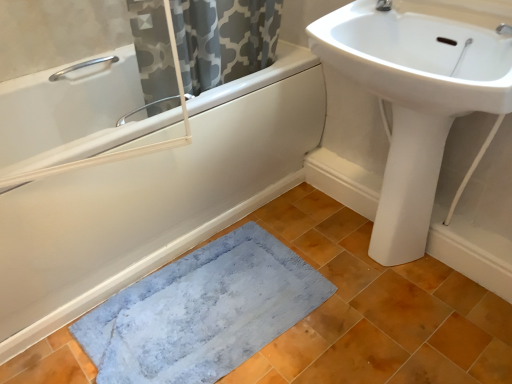
Find the location of a particular element. white matte bathtub at lower left is located at coordinates (154, 199).

The image size is (512, 384). Describe the element at coordinates (408, 186) in the screenshot. I see `white glossy bidet at lower right` at that location.

At what (x,y) coordinates should I click in order to perform the action: click on white glossy bidet at lower right. Please return your answer as a coordinate pair (x, y). The image size is (512, 384). Looking at the image, I should click on (408, 186).

Find the location of a particular element. This screenshot has width=512, height=384. white matte bathtub at lower left is located at coordinates (154, 199).

Is white glossy sink at upper right facing away from blue soft rug at lower left?

No, white glossy sink at upper right is not facing away from blue soft rug at lower left.

Which object is positioned more to the left, white glossy sink at upper right or blue soft rug at lower left?

Positioned to the left is blue soft rug at lower left.

Is point (379, 227) less distant than point (187, 255)?

Yes, point (379, 227) is closer to viewer.

Can you confirm if white glossy sink at upper right is bigger than blue soft rug at lower left?

Indeed, white glossy sink at upper right has a larger size compared to blue soft rug at lower left.

Consider the image. Who is smaller, blue soft rug at lower left or white glossy bidet at lower right?

blue soft rug at lower left is smaller.

Is the position of blue soft rug at lower left less distant than that of white glossy bidet at lower right?

Yes, blue soft rug at lower left is closer to the viewer.

Is blue soft rug at lower left taller or shorter than white glossy bidet at lower right?

Clearly, blue soft rug at lower left is shorter compared to white glossy bidet at lower right.

At what (x,y) coordinates should I click in order to perform the action: click on bath mat on the left side of white glossy bidet at lower right. Please return your answer as a coordinate pair (x, y). The height and width of the screenshot is (384, 512). Looking at the image, I should click on (202, 311).

In the scene shown: Is silver metallic grab bar at upper left looking in the opposite direction of white glossy sink at upper right?

No, silver metallic grab bar at upper left's orientation is not away from white glossy sink at upper right.

Which point is more distant from viewer, (x=61, y=71) or (x=449, y=41)?

The point (x=61, y=71) is farther.

Considering the positions of objects silver metallic grab bar at upper left and white glossy sink at upper right in the image provided, who is in front, silver metallic grab bar at upper left or white glossy sink at upper right?

white glossy sink at upper right is closer to the camera.

Looking at this image, what's the angular difference between silver metallic grab bar at upper left and white glossy sink at upper right's facing directions?

89.2 degrees.

How distant is white glossy sink at upper right from silver metallic grab bar at upper left?

white glossy sink at upper right and silver metallic grab bar at upper left are 3.32 feet apart.

Considering the sizes of objects white glossy sink at upper right and silver metallic grab bar at upper left in the image provided, who is wider, white glossy sink at upper right or silver metallic grab bar at upper left?

Wider between the two is white glossy sink at upper right.

Is white glossy sink at upper right to the left or to the right of silver metallic grab bar at upper left in the image?

From the image, it's evident that white glossy sink at upper right is to the right of silver metallic grab bar at upper left.

Is white glossy sink at upper right not close to silver metallic grab bar at upper left?

white glossy sink at upper right is positioned a significant distance from silver metallic grab bar at upper left.

In the scene shown: From their relative heights in the image, would you say blue soft rug at lower left is taller or shorter than white glossy sink at upper right?

blue soft rug at lower left is shorter than white glossy sink at upper right.

Is point (172, 288) farther from viewer compared to point (435, 167)?

That is True.

Is blue soft rug at lower left looking in the opposite direction of white glossy sink at upper right?

No, white glossy sink at upper right is not at the back of blue soft rug at lower left.

From a real-world perspective, which is physically above, blue soft rug at lower left or white glossy sink at upper right?

From a 3D spatial view, white glossy sink at upper right is above.

Considering the relative positions of silver metallic grab bar at upper left and white matte bathtub at lower left in the image provided, is silver metallic grab bar at upper left in front of white matte bathtub at lower left?

No.

Is silver metallic grab bar at upper left not near white matte bathtub at lower left?

No, silver metallic grab bar at upper left is not far from white matte bathtub at lower left.

Consider the image. Does silver metallic grab bar at upper left have a lesser height compared to white matte bathtub at lower left?

Correct, silver metallic grab bar at upper left is not as tall as white matte bathtub at lower left.

What's the angular difference between silver metallic grab bar at upper left and white matte bathtub at lower left's facing directions?

There is a 0.402-degree angle between the facing directions of silver metallic grab bar at upper left and white matte bathtub at lower left.

From the image's perspective, between white matte bathtub at lower left and white glossy sink at upper right, who is located below?

white matte bathtub at lower left is shown below in the image.

Could white glossy sink at upper right be considered to be inside white matte bathtub at lower left?

No.

Which of these two, white matte bathtub at lower left or white glossy sink at upper right, is wider?

Wider between the two is white matte bathtub at lower left.

Considering the sizes of objects white matte bathtub at lower left and white glossy sink at upper right in the image provided, who is bigger, white matte bathtub at lower left or white glossy sink at upper right?

white matte bathtub at lower left.

Locate an element on the screen. The width and height of the screenshot is (512, 384). sink above the blue soft rug at lower left (from the image's perspective) is located at coordinates (414, 102).

What are the coordinates of `bidet lying on the right of blue soft rug at lower left` in the screenshot? It's located at (408, 186).

Based on the photo, estimate the real-world distances between objects in this image. Which object is closer to white glossy bidet at lower right, white matte bathtub at lower left or blue soft rug at lower left?

blue soft rug at lower left.

Based on their spatial positions, is white glossy bidet at lower right or blue soft rug at lower left closer to white glossy sink at upper right?

white glossy bidet at lower right is closer to white glossy sink at upper right.

Estimate the real-world distances between objects in this image. Which object is further from silver metallic grab bar at upper left, white matte bathtub at lower left or white glossy bidet at lower right?

white glossy bidet at lower right.

Looking at the image, which one is located further to silver metallic grab bar at upper left, white glossy sink at upper right or blue soft rug at lower left?

white glossy sink at upper right is positioned further to the anchor silver metallic grab bar at upper left.

Looking at the image, which one is located further to blue soft rug at lower left, white glossy bidet at lower right or white glossy sink at upper right?

white glossy sink at upper right.

Looking at the image, which one is located closer to white glossy sink at upper right, white glossy bidet at lower right or silver metallic grab bar at upper left?

white glossy bidet at lower right lies closer to white glossy sink at upper right than the other object.

From the picture: Considering their positions, is white glossy sink at upper right positioned closer to blue soft rug at lower left than white matte bathtub at lower left?

white matte bathtub at lower left.

When comparing their distances from white glossy sink at upper right, does white glossy bidet at lower right or white matte bathtub at lower left seem further?

Among the two, white matte bathtub at lower left is located further to white glossy sink at upper right.

Identify the location of bathtub located between silver metallic grab bar at upper left and white glossy sink at upper right in the left-right direction. The image size is (512, 384). (154, 199).

Identify the location of sink situated between silver metallic grab bar at upper left and white glossy bidet at lower right from left to right. (414, 102).

This screenshot has height=384, width=512. What are the coordinates of `bathtub between silver metallic grab bar at upper left and blue soft rug at lower left in the vertical direction` in the screenshot? It's located at (154, 199).

At what (x,y) coordinates should I click in order to perform the action: click on sink located between white matte bathtub at lower left and white glossy bidet at lower right in the left-right direction. Please return your answer as a coordinate pair (x, y). Looking at the image, I should click on (414, 102).